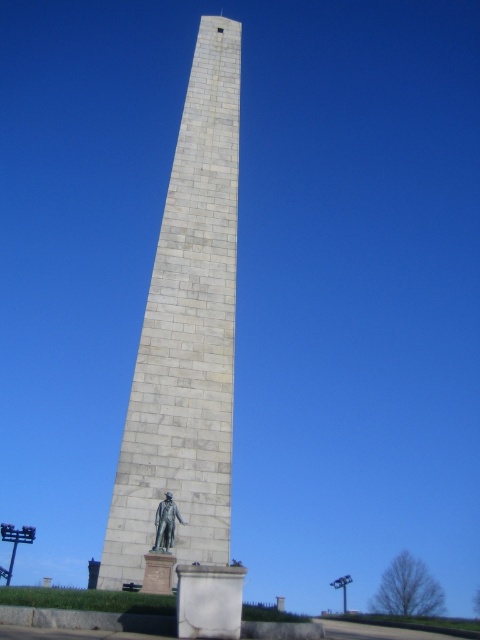
Question: Which object is farther from the camera taking this photo?

Choices:
 (A) white stone obelisk at center
 (B) bronze statue at lower center

Answer: (A)

Question: Does white stone obelisk at center appear on the right side of bronze statue at lower center?

Choices:
 (A) yes
 (B) no

Answer: (B)

Question: Is white stone obelisk at center bigger than bronze statue at lower center?

Choices:
 (A) no
 (B) yes

Answer: (B)

Question: Does white stone obelisk at center have a greater width compared to bronze statue at lower center?

Choices:
 (A) yes
 (B) no

Answer: (A)

Question: Which point is farther from the camera taking this photo?

Choices:
 (A) (148, 550)
 (B) (195, 385)

Answer: (B)

Question: Among these objects, which one is nearest to the camera?

Choices:
 (A) bronze statue at lower center
 (B) white stone obelisk at center

Answer: (A)